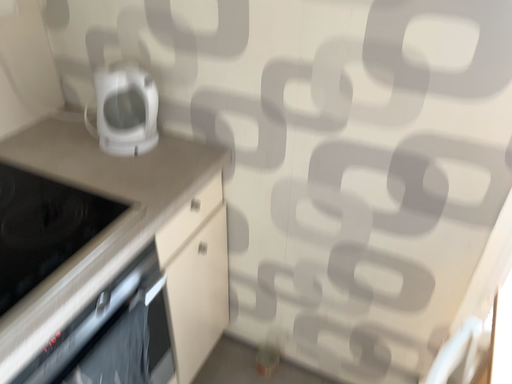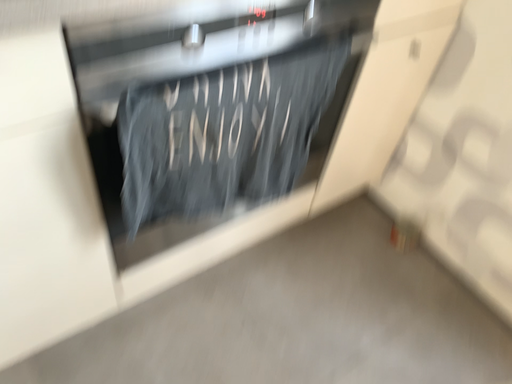
Question: How did the camera likely rotate when shooting the video?

Choices:
 (A) rotated right
 (B) rotated left

Answer: (B)